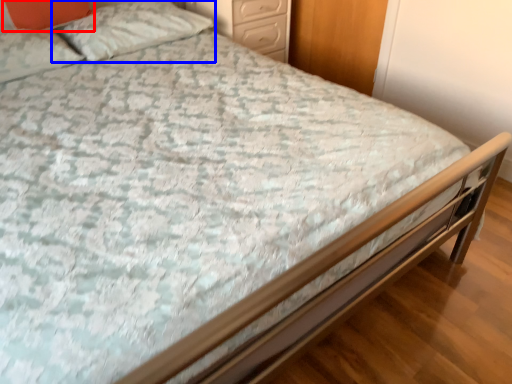
Question: Which object appears closest to the camera in this image, pillow (highlighted by a red box) or pillow (highlighted by a blue box)?

Choices:
 (A) pillow
 (B) pillow

Answer: (A)